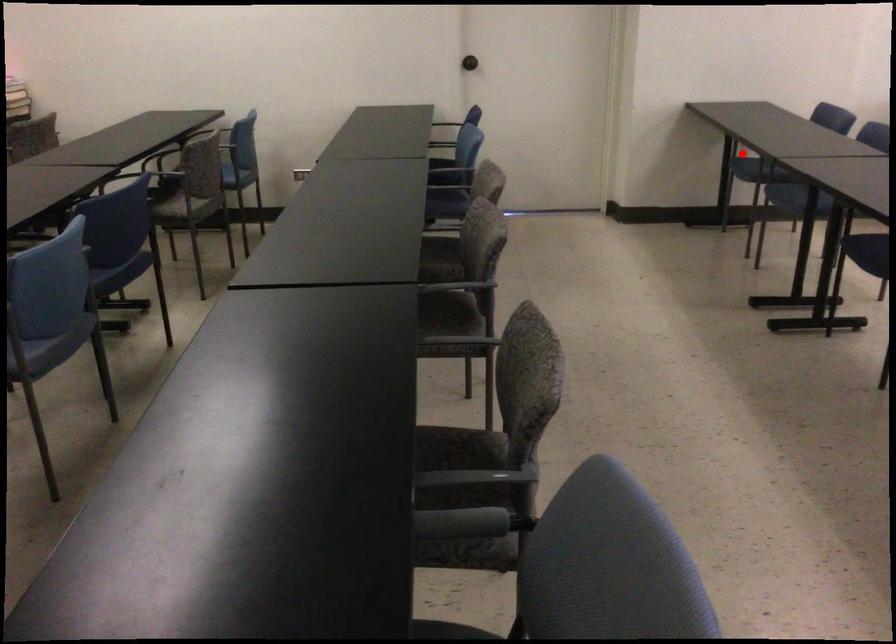
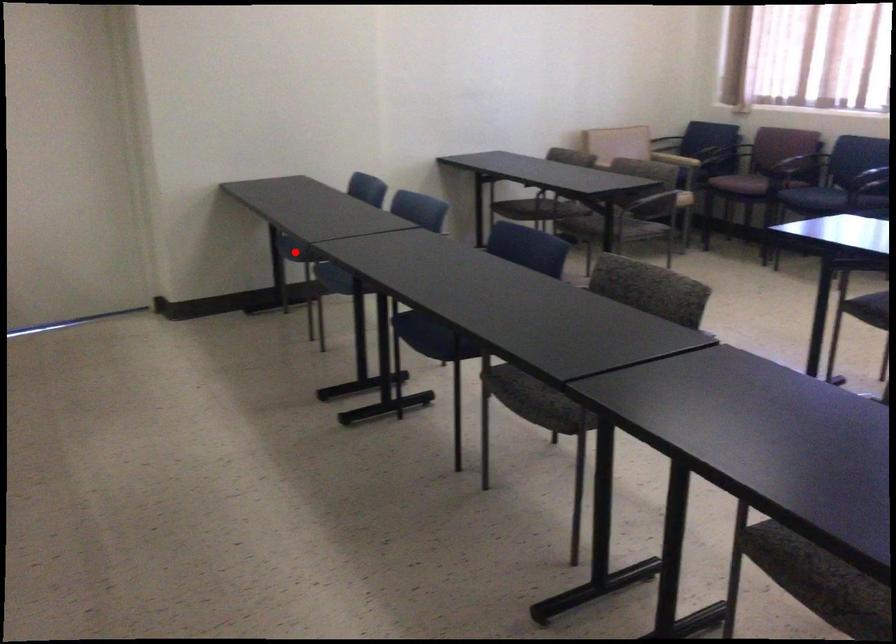
I am providing you with two images of the same scene from different viewpoints. A red point is marked on the first image and another point is marked on the second image. Are the points marked in image1 and image2 representing the same 3D position?

Yes